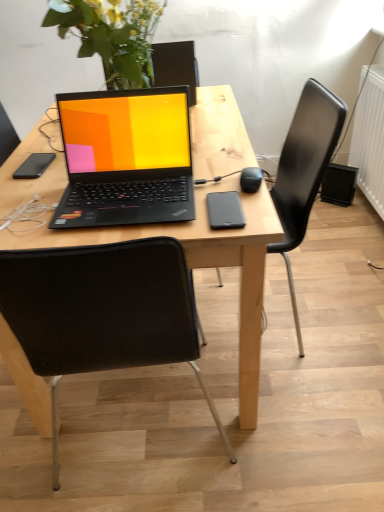
Locate an element on the screen. The height and width of the screenshot is (512, 384). free region on the left part of black matte phone at center, which appears as the 2th mobile phone when viewed from the back is located at coordinates (166, 214).